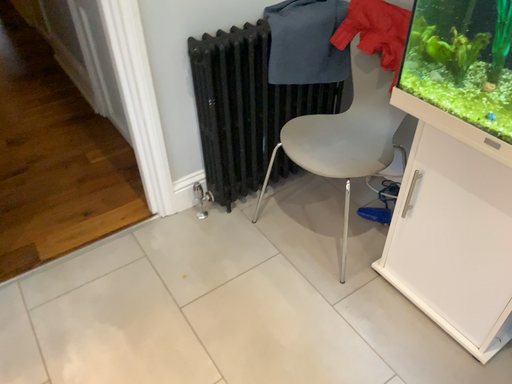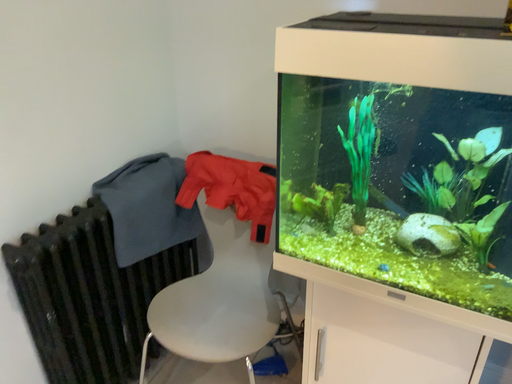
Question: How did the camera likely rotate when shooting the video?

Choices:
 (A) rotated right
 (B) rotated left

Answer: (A)